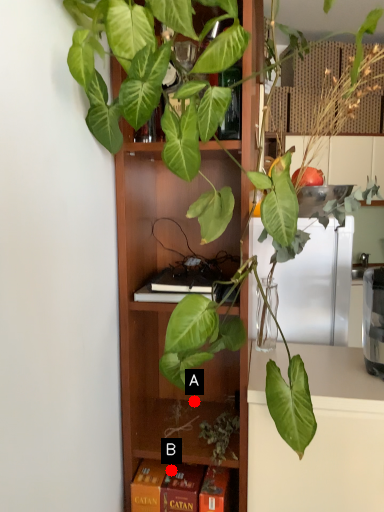
Question: Two points are circled on the image, labeled by A and B beside each circle. Which of the following is the farthest from the observer?

Choices:
 (A) A is further
 (B) B is further

Answer: (A)